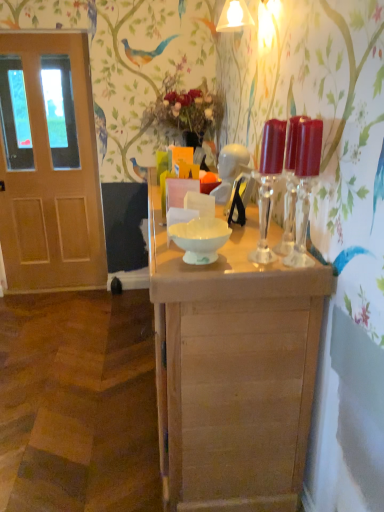
This screenshot has width=384, height=512. I want to click on free space below white glossy bowl at center (from a real-world perspective), so click(190, 264).